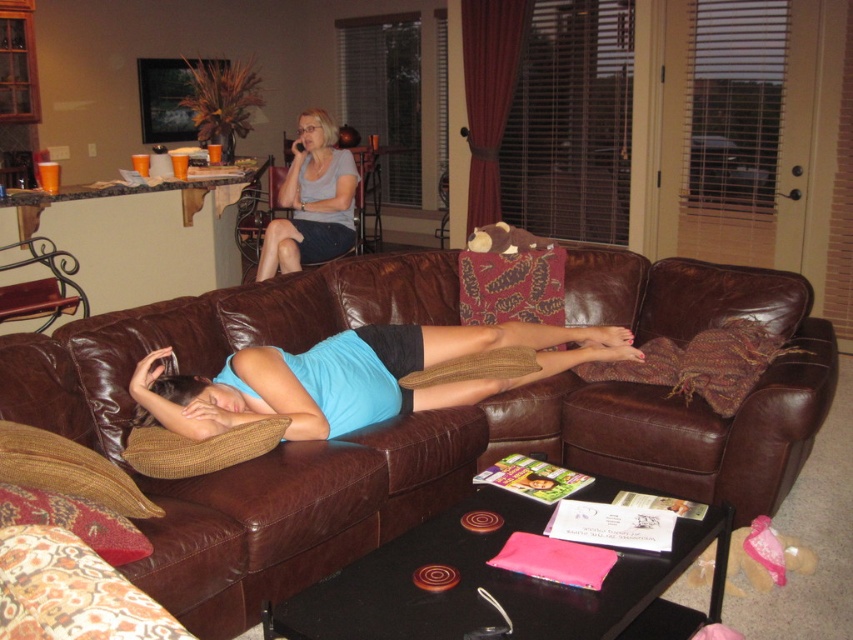
Question: Is brown textured pillow at lower left above brown woven pillow at center?

Choices:
 (A) no
 (B) yes

Answer: (A)

Question: Which of the following is the farthest from the observer?

Choices:
 (A) brown woven pillow at center
 (B) brown textured pillow at lower left

Answer: (A)

Question: Can you confirm if brown leather couch at center is positioned to the right of blue fabric pillow at center?

Choices:
 (A) yes
 (B) no

Answer: (A)

Question: Which of the following is the closest to the observer?

Choices:
 (A) (184, 465)
 (B) (270, 364)

Answer: (A)

Question: Among these objects, which one is nearest to the camera?

Choices:
 (A) brown leather couch at center
 (B) brown woven pillow at center

Answer: (A)

Question: Can you confirm if brown leather couch at center is positioned above brown textured pillow at lower left?

Choices:
 (A) yes
 (B) no

Answer: (A)